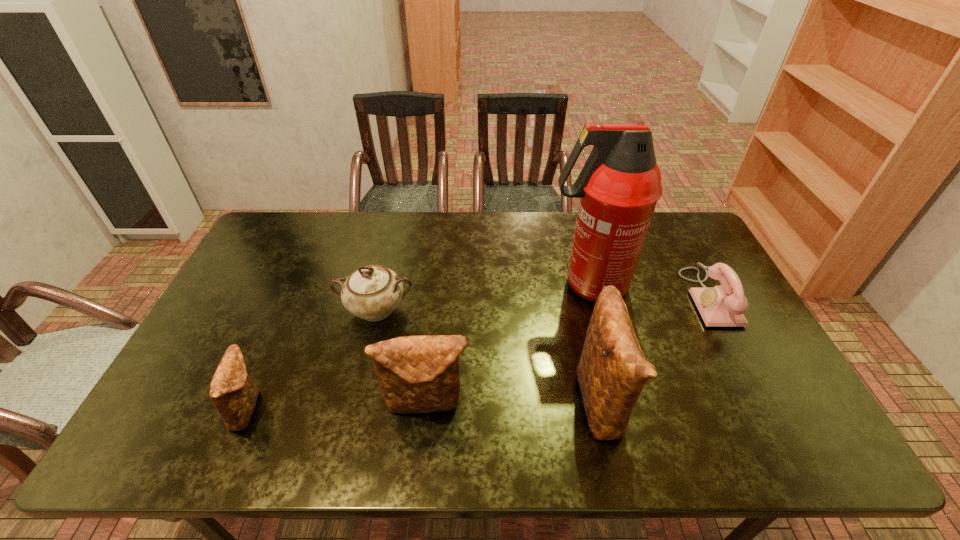
This screenshot has width=960, height=540. What are the coordinates of `vacant place for an extra clutch bag on the right` in the screenshot? It's located at (775, 395).